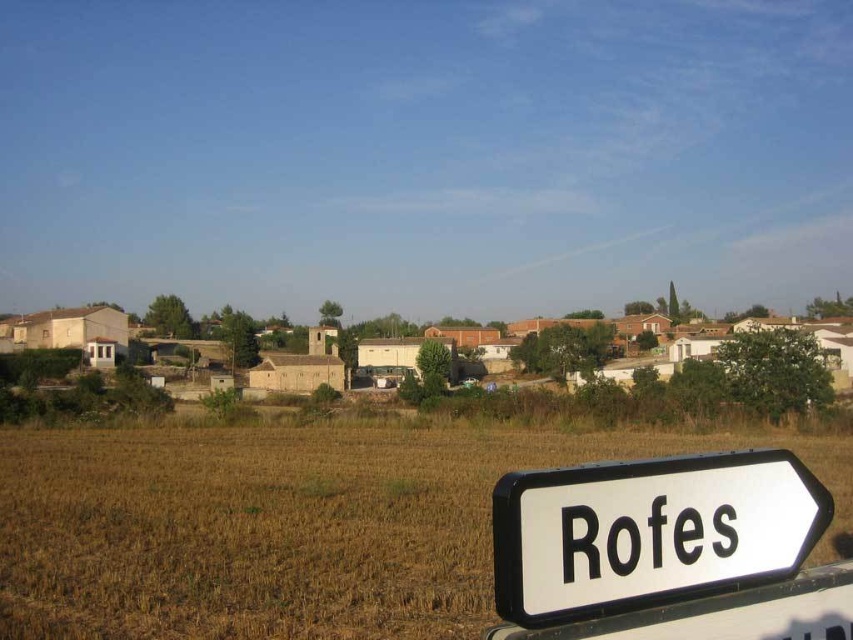
Question: Can you confirm if brown grassland at lower left is positioned to the right of white plastic sign at lower right?

Choices:
 (A) yes
 (B) no

Answer: (A)

Question: Does brown grassland at lower left appear on the right side of white plastic sign at lower right?

Choices:
 (A) yes
 (B) no

Answer: (A)

Question: Which point appears closest to the camera in this image?

Choices:
 (A) [x=548, y=556]
 (B) [x=323, y=627]

Answer: (A)

Question: Among these points, which one is nearest to the camera?

Choices:
 (A) (245, 611)
 (B) (616, 484)

Answer: (B)

Question: In this image, where is brown grassland at lower left located relative to white plastic sign at lower right?

Choices:
 (A) left
 (B) right

Answer: (B)